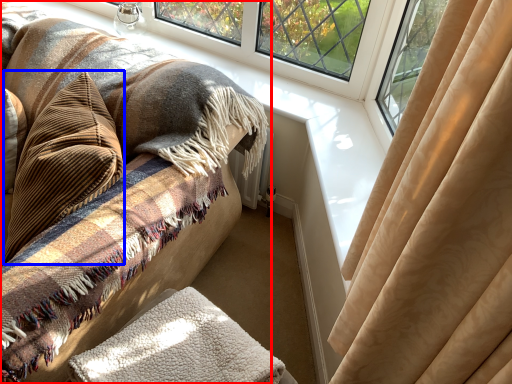
Question: Among these objects, which one is farthest to the camera, furniture (highlighted by a red box) or throw pillow (highlighted by a blue box)?

Choices:
 (A) furniture
 (B) throw pillow

Answer: (B)